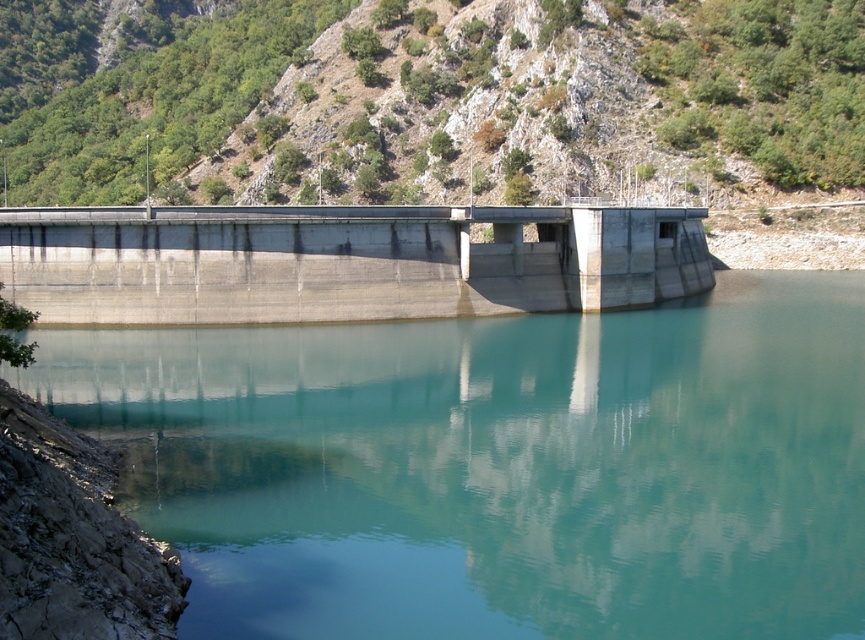
Question: Which of the following is the closest to the observer?

Choices:
 (A) green textured hillside at upper center
 (B) gray concrete dam at center

Answer: (B)

Question: Does teal smooth water at center have a smaller size compared to green textured hillside at upper center?

Choices:
 (A) yes
 (B) no

Answer: (A)

Question: Which of the following is the farthest from the observer?

Choices:
 (A) (792, 177)
 (B) (426, 218)

Answer: (A)

Question: Which of the following is the farthest from the observer?

Choices:
 (A) (462, 458)
 (B) (670, 275)
 (C) (554, 92)

Answer: (C)

Question: Does green textured hillside at upper center appear under gray concrete dam at center?

Choices:
 (A) yes
 (B) no

Answer: (B)

Question: Is teal smooth water at center above gray concrete dam at center?

Choices:
 (A) no
 (B) yes

Answer: (A)